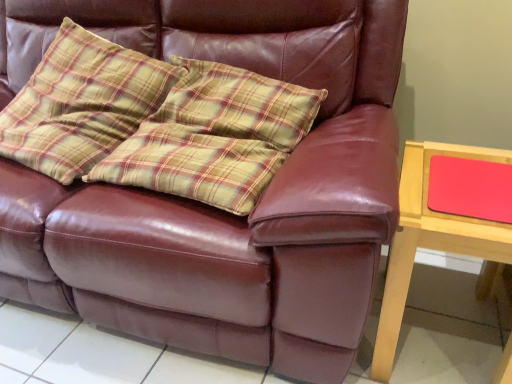
What is the approximate height of plaid fabric pillow at upper left?

plaid fabric pillow at upper left is 24.38 inches tall.

Image resolution: width=512 pixels, height=384 pixels. I want to click on wooden table at right, so click(430, 239).

Does point (507, 204) come in front of point (446, 245)?

No, it is not.

Are matte red mousepad at right and wooden table at right located far from each other?

matte red mousepad at right is actually quite close to wooden table at right.

Could you tell me if matte red mousepad at right is turned towards wooden table at right?

Yes, matte red mousepad at right is turned towards wooden table at right.

Who is bigger, matte red mousepad at right or wooden table at right?

With larger size is wooden table at right.

Which is more to the left, plaid fabric pillow at upper left or wooden table at right?

plaid fabric pillow at upper left.

Between point (100, 98) and point (424, 231), which one is positioned behind?

Point (100, 98)

Does plaid fabric pillow at upper left have a larger size compared to wooden table at right?

Yes.

Does plaid fabric pillow at upper left have a larger size compared to matte red mousepad at right?

Yes.

Considering the relative sizes of plaid fabric pillow at upper left and matte red mousepad at right in the image provided, is plaid fabric pillow at upper left shorter than matte red mousepad at right?

No.

Is plaid fabric pillow at upper left outside of matte red mousepad at right?

Yes, plaid fabric pillow at upper left is outside of matte red mousepad at right.

What's the angular difference between plaid fabric pillow at upper left and matte red mousepad at right's facing directions?

plaid fabric pillow at upper left and matte red mousepad at right are facing 3.95 degrees away from each other.

Is there a large distance between matte red mousepad at right and plaid fabric pillow at upper left?

Yes, matte red mousepad at right and plaid fabric pillow at upper left are quite far apart.

Does matte red mousepad at right lie behind plaid fabric pillow at upper left?

No, it is not.

Considering the sizes of objects matte red mousepad at right and plaid fabric pillow at upper left in the image provided, who is shorter, matte red mousepad at right or plaid fabric pillow at upper left?

matte red mousepad at right.

From the picture: Is wooden table at right oriented towards plaid fabric pillow at upper left?

No, wooden table at right is not aimed at plaid fabric pillow at upper left.

Considering the positions of point (481, 224) and point (36, 112), is point (481, 224) closer or farther from the camera than point (36, 112)?

Point (481, 224) is closer to the camera than point (36, 112).

From a real-world perspective, which object rests below the other?

From a 3D spatial view, wooden table at right is below.

From a real-world perspective, does wooden table at right sit lower than matte red mousepad at right?

Correct, in the physical world, wooden table at right is lower than matte red mousepad at right.

Is there a large distance between wooden table at right and matte red mousepad at right?

No, wooden table at right is not far from matte red mousepad at right.

Can you tell me how much wooden table at right and matte red mousepad at right differ in facing direction?

The angular difference between wooden table at right and matte red mousepad at right is 0.957 degrees.

Where is `table in front of the matte red mousepad at right`? table in front of the matte red mousepad at right is located at coordinates (430, 239).

This screenshot has width=512, height=384. In order to click on throw pillow behind the wooden table at right in this screenshot , I will do `click(81, 103)`.

Based on their spatial positions, is plaid fabric pillow at upper left or wooden table at right further from matte red mousepad at right?

Among the two, plaid fabric pillow at upper left is located further to matte red mousepad at right.

From the image, which object appears to be nearer to plaid fabric pillow at upper left, wooden table at right or matte red mousepad at right?

Based on the image, wooden table at right appears to be nearer to plaid fabric pillow at upper left.

Which object lies nearer to the anchor point wooden table at right, plaid fabric pillow at upper left or matte red mousepad at right?

The object closer to wooden table at right is matte red mousepad at right.

Looking at the image, which one is located closer to matte red mousepad at right, wooden table at right or plaid fabric pillow at upper left?

Among the two, wooden table at right is located nearer to matte red mousepad at right.

Based on the photo, looking at the image, which one is located further to plaid fabric pillow at upper left, matte red mousepad at right or wooden table at right?

The object further to plaid fabric pillow at upper left is matte red mousepad at right.

Looking at the image, which one is located further to wooden table at right, matte red mousepad at right or plaid fabric pillow at upper left?

Based on the image, plaid fabric pillow at upper left appears to be further to wooden table at right.

This screenshot has height=384, width=512. What are the coordinates of `pad between plaid fabric pillow at upper left and wooden table at right in the horizontal direction` in the screenshot? It's located at (470, 188).